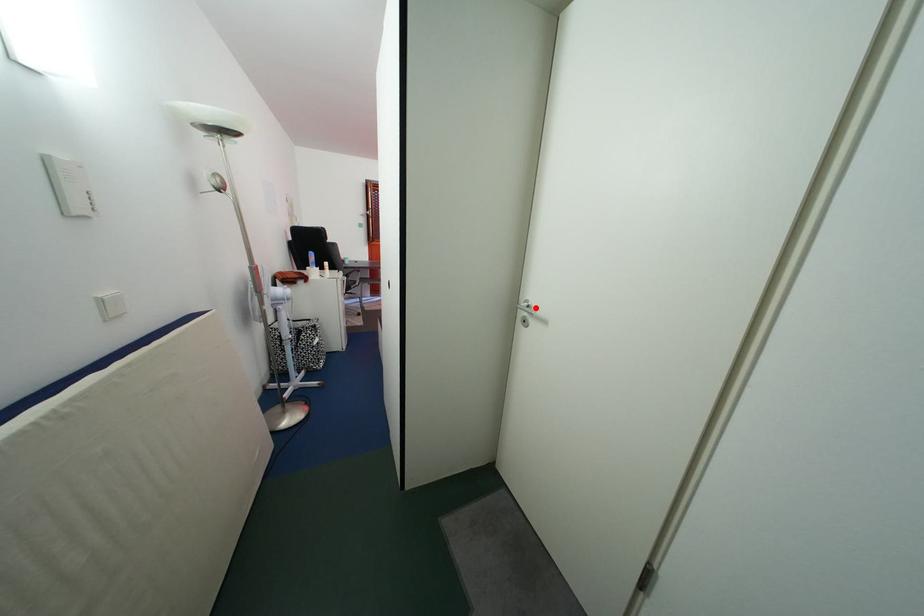
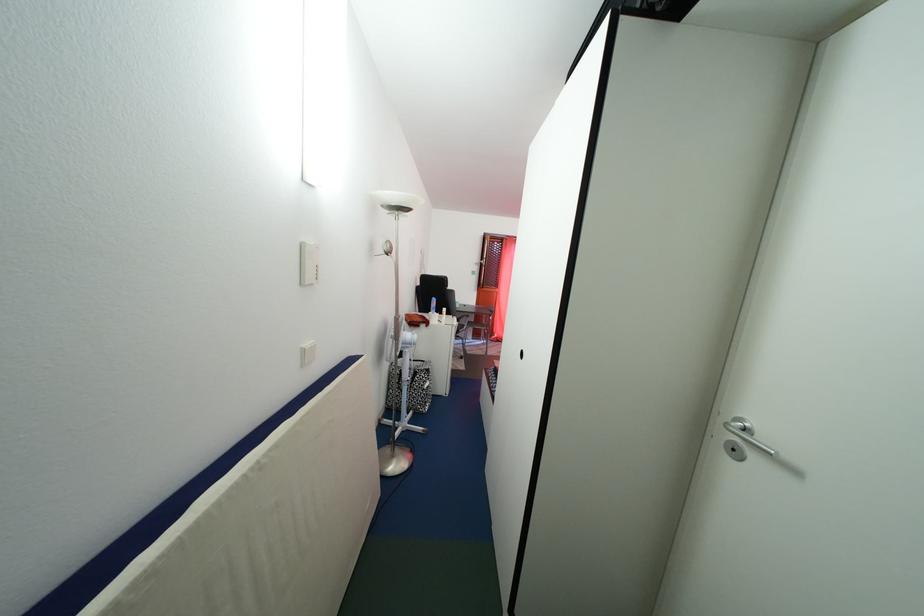
The point at the highlighted location is marked in the first image. Where is the corresponding point in the second image?

(748, 426)